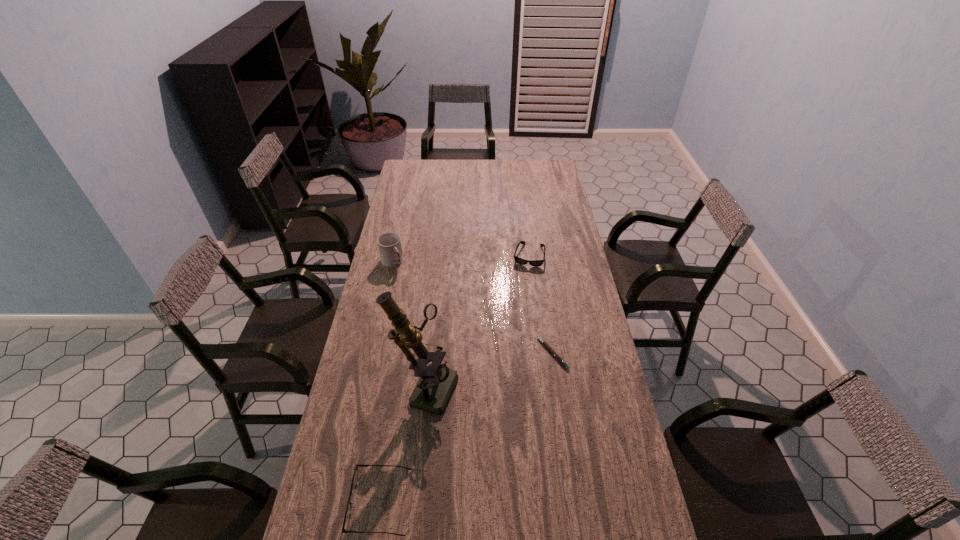
The image size is (960, 540). Find the location of `microscope that is at the left edge`. microscope that is at the left edge is located at coordinates (436, 383).

Locate an element on the screen. The height and width of the screenshot is (540, 960). cup that is at the left edge is located at coordinates (389, 244).

Locate an element on the screen. This screenshot has width=960, height=540. pen located in the right edge section of the desktop is located at coordinates (545, 344).

The image size is (960, 540). I want to click on sunglasses at the right edge, so click(x=536, y=263).

This screenshot has height=540, width=960. I want to click on object that is positioned at the near left corner, so click(x=355, y=475).

Where is `vacant position at the far edge of the desktop`? The height and width of the screenshot is (540, 960). vacant position at the far edge of the desktop is located at coordinates (492, 175).

Locate an element on the screen. The image size is (960, 540). vacant space at the near edge of the desktop is located at coordinates (402, 529).

You are a GUI agent. You are given a task and a screenshot of the screen. Output one action in this format:
    pyautogui.click(x=<x>, y=<y>)
    Task: Click on the free space at the left edge of the desktop
    The height and width of the screenshot is (540, 960).
    Given the screenshot: What is the action you would take?
    click(361, 461)

You are a GUI agent. You are given a task and a screenshot of the screen. Output one action in this format:
    pyautogui.click(x=<x>, y=<y>)
    Task: Click on the vacant space at the right edge of the desktop
    
    Given the screenshot: What is the action you would take?
    pyautogui.click(x=553, y=280)

The height and width of the screenshot is (540, 960). Identify the location of empty space between the pen and the tallest object. pos(489,369).